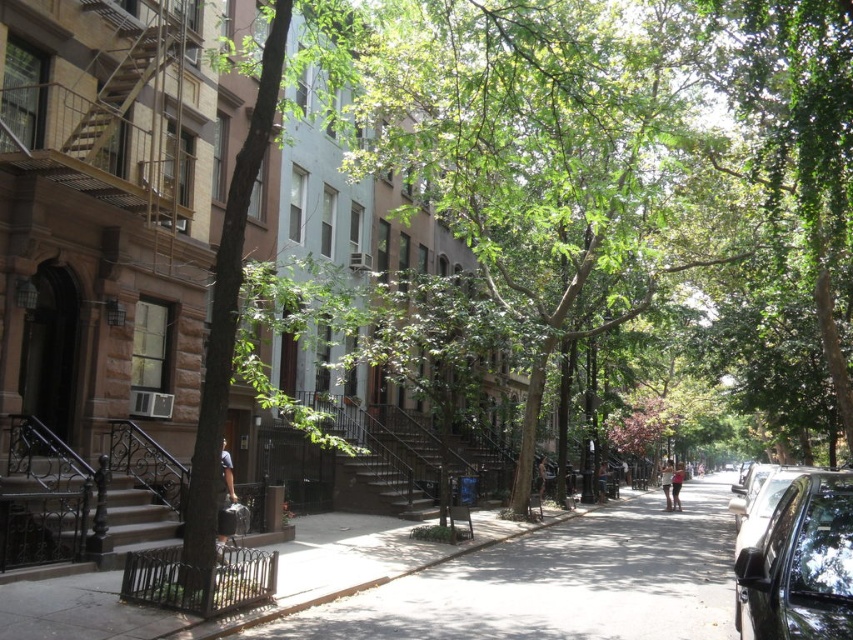
You are a delivery person standing at the entrance of the building. You need to walk to the smooth concrete sidewalk at center. Which direction should you walk relative to the building entrance?

The smooth concrete sidewalk at center is located at point (558, 582), so you should walk forward from the building entrance towards the center of the scene to reach it.